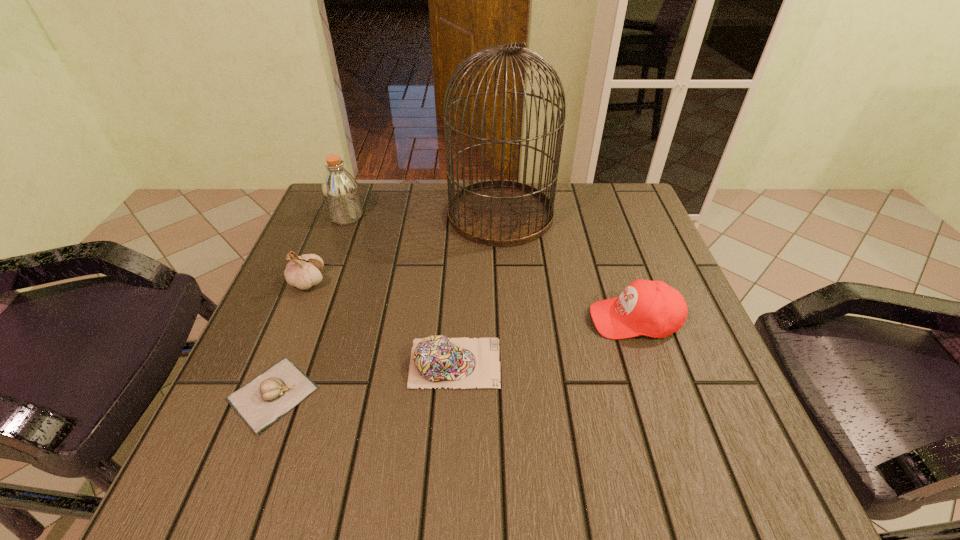
At what (x,y) coordinates should I click in order to perform the action: click on free space between the farther garlic and the tallest object. Please return your answer as a coordinate pair (x, y). Looking at the image, I should click on (404, 248).

At what (x,y) coordinates should I click in order to perform the action: click on vacant space that's between the baseball cap and the fifth tallest object. Please return your answer as a coordinate pair (x, y). The width and height of the screenshot is (960, 540). Looking at the image, I should click on (544, 341).

The width and height of the screenshot is (960, 540). Identify the location of vacant space in between the shortest object and the third farthest object. (290, 338).

I want to click on free spot between the cap and the second tallest object, so click(401, 289).

You are a GUI agent. You are given a task and a screenshot of the screen. Output one action in this format:
    pyautogui.click(x=<x>, y=<y>)
    Task: Click on the free spot between the shorter garlic and the birdcage
    This screenshot has height=540, width=960.
    Given the screenshot: What is the action you would take?
    pyautogui.click(x=387, y=304)

The image size is (960, 540). I want to click on vacant space that is in between the tallest object and the shorter garlic, so click(x=387, y=304).

This screenshot has width=960, height=540. I want to click on free space that is in between the fourth nearest object and the second shortest object, so click(381, 322).

Locate an element on the screen. blank region between the farther garlic and the fifth tallest object is located at coordinates (381, 322).

This screenshot has width=960, height=540. I want to click on vacant space that is in between the shortest object and the cap, so click(364, 378).

You are a GUI agent. You are given a task and a screenshot of the screen. Output one action in this format:
    pyautogui.click(x=<x>, y=<y>)
    Task: Click on the object that stands as the closest to the fourth nearest object
    Image resolution: width=960 pixels, height=540 pixels.
    Given the screenshot: What is the action you would take?
    pyautogui.click(x=261, y=402)